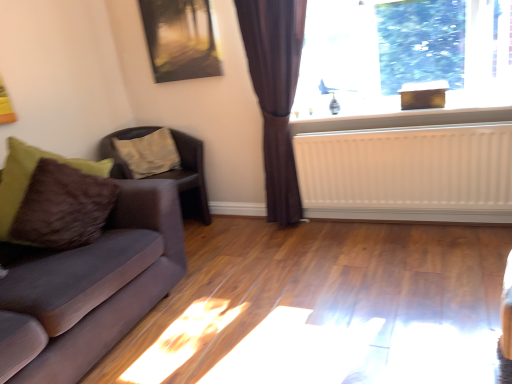
Question: From the image's perspective, does white painted wood at upper right appear higher than metallic reflective painting at upper center?

Choices:
 (A) yes
 (B) no

Answer: (B)

Question: Does white painted wood at upper right have a lesser height compared to metallic reflective painting at upper center?

Choices:
 (A) yes
 (B) no

Answer: (A)

Question: Is white painted wood at upper right far from metallic reflective painting at upper center?

Choices:
 (A) no
 (B) yes

Answer: (B)

Question: Does white painted wood at upper right have a lesser width compared to metallic reflective painting at upper center?

Choices:
 (A) no
 (B) yes

Answer: (A)

Question: Is white painted wood at upper right positioned before metallic reflective painting at upper center?

Choices:
 (A) no
 (B) yes

Answer: (B)

Question: Does point pyautogui.click(x=158, y=173) appear closer or farther from the camera than point pyautogui.click(x=455, y=119)?

Choices:
 (A) farther
 (B) closer

Answer: (A)

Question: From the image's perspective, is brown textured pillow at left above or below white painted wood at upper right?

Choices:
 (A) above
 (B) below

Answer: (B)

Question: Would you say brown textured pillow at left is inside or outside white painted wood at upper right?

Choices:
 (A) inside
 (B) outside

Answer: (B)

Question: Is brown textured pillow at left wider or thinner than white painted wood at upper right?

Choices:
 (A) wide
 (B) thin

Answer: (A)

Question: Looking at the image, does white painted wood at upper right seem bigger or smaller compared to transparent glass window at upper right?

Choices:
 (A) big
 (B) small

Answer: (B)

Question: Is white painted wood at upper right to the left or to the right of transparent glass window at upper right in the image?

Choices:
 (A) right
 (B) left

Answer: (A)

Question: Does point (374, 125) appear closer or farther from the camera than point (309, 16)?

Choices:
 (A) farther
 (B) closer

Answer: (B)

Question: From a real-world perspective, relative to transparent glass window at upper right, is white painted wood at upper right vertically above or below?

Choices:
 (A) above
 (B) below

Answer: (B)

Question: Is transparent glass window at upper right situated inside metallic reflective painting at upper center or outside?

Choices:
 (A) outside
 (B) inside

Answer: (A)

Question: Is point (444, 46) positioned closer to the camera than point (193, 8)?

Choices:
 (A) closer
 (B) farther

Answer: (B)